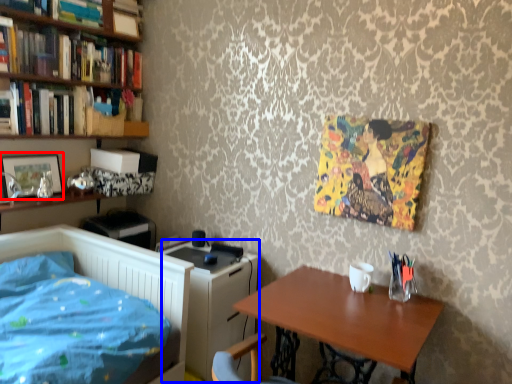
Question: Which object is closer to the camera taking this photo, picture frame (highlighted by a red box) or computer desk (highlighted by a blue box)?

Choices:
 (A) picture frame
 (B) computer desk

Answer: (B)